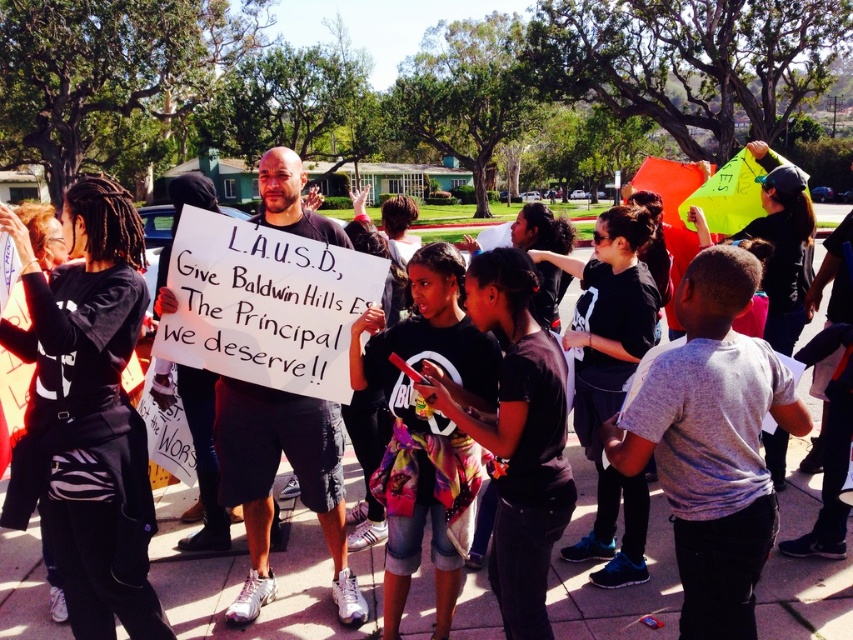
Is multicolored denim shorts at center further to the viewer compared to white paper sign at center?

No, multicolored denim shorts at center is closer to the viewer.

From the picture: Does multicolored denim shorts at center have a lesser height compared to white paper sign at center?

In fact, multicolored denim shorts at center may be taller than white paper sign at center.

What are the coordinates of `multicolored denim shorts at center` in the screenshot? It's located at (425, 424).